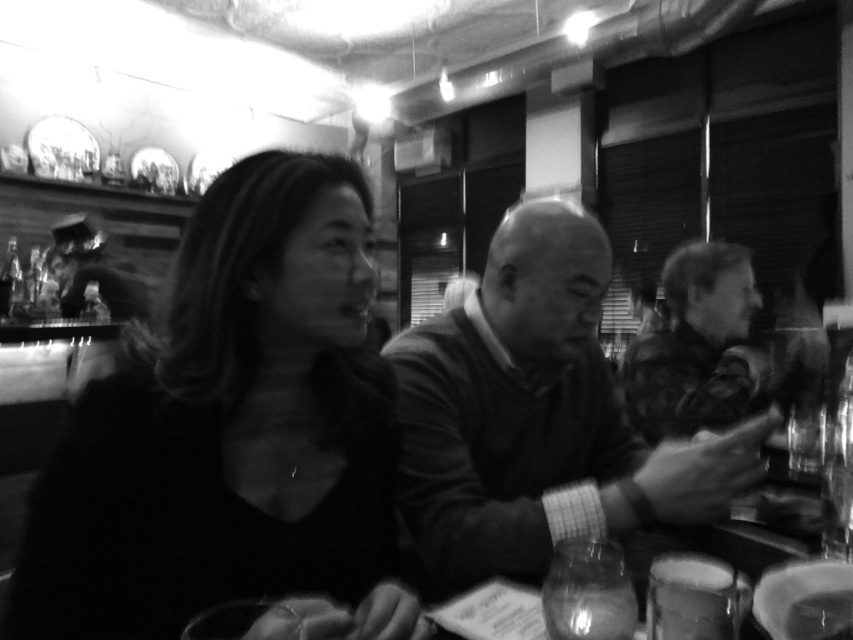
In the scene shown: Please provide the 2D coordinates of the smooth black shirt at center in the image. The answer should be in the format of coordinates in parentheses. 2D coordinates are measured from the bottom left corner of the image as the origin. The x and y axes are normalized between 0 and 1. The x axis increases to the right, and the y axis increases upward.

The smooth black shirt at center is located at coordinates point [231,429].

Looking at this image, you are a photographer trying to capture a candid shot of both the smooth black shirt at center and the camouflage jacket at right. Since you want to ensure both are in focus, which object should you adjust your camera focus on first to account for their sizes?

The smooth black shirt at center is smaller in size compared to the camouflage jacket at right, so you should focus on the smooth black shirt at center first to ensure it is in focus before adjusting for the larger camouflage jacket at right.

You are a photographer trying to capture a closeup of the smooth black shirt at center without the smooth sweater at center blocking it. Based on their positions, is this possible?

Yes, the smooth black shirt at center is in front of the smooth sweater at center, so it can be captured without obstruction from the smooth sweater at center.